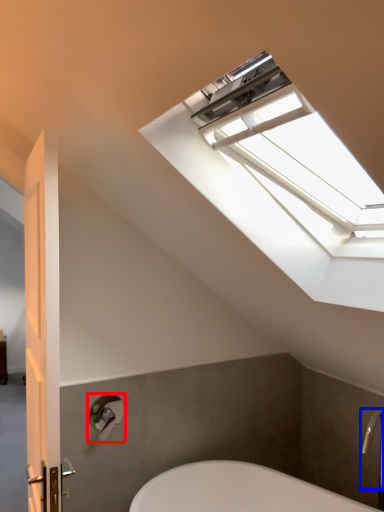
Question: Which object appears closest to the camera in this image, shower (highlighted by a red box) or faucet (highlighted by a blue box)?

Choices:
 (A) shower
 (B) faucet

Answer: (B)